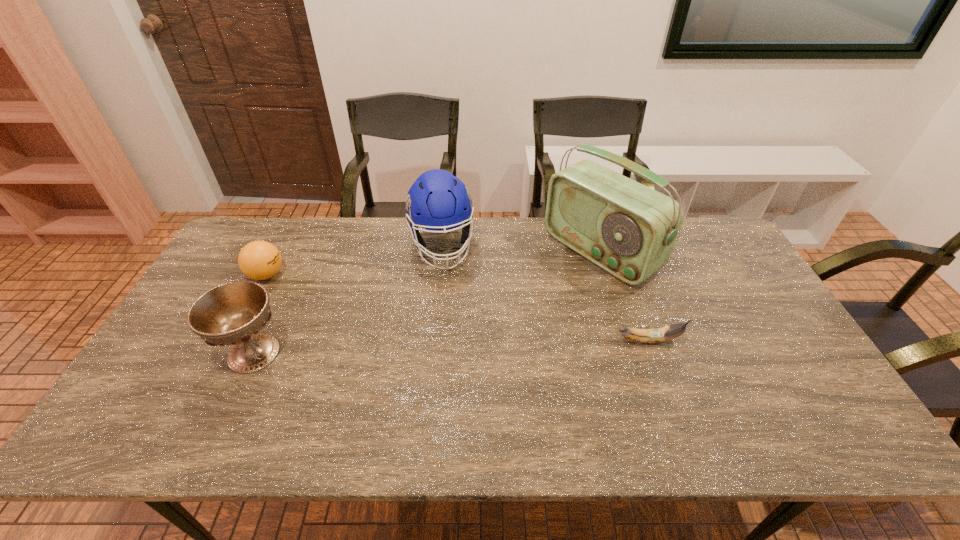
Identify the location of vacant space situated on the front panel of the tallest object. (493, 326).

At what (x,y) coordinates should I click in order to perform the action: click on free space located on the side with brand of the ping-pong ball. Please return your answer as a coordinate pair (x, y). The height and width of the screenshot is (540, 960). Looking at the image, I should click on (304, 295).

Locate an element on the screen. The image size is (960, 540). free space located on the side with brand of the ping-pong ball is located at coordinates (375, 333).

At what (x,y) coordinates should I click in order to perform the action: click on vacant space located 0.120m on the side with brand of the ping-pong ball. Please return your answer as a coordinate pair (x, y). Image resolution: width=960 pixels, height=540 pixels. Looking at the image, I should click on (307, 296).

Identify the location of free space located on the front-facing side of the football helmet. This screenshot has height=540, width=960. (462, 359).

Find the location of `vacant area situated on the front-facing side of the football helmet`. vacant area situated on the front-facing side of the football helmet is located at coordinates (463, 366).

Find the location of `vacant space situated on the front-facing side of the football helmet`. vacant space situated on the front-facing side of the football helmet is located at coordinates (462, 359).

Identify the location of radio receiver that is at the far edge. The width and height of the screenshot is (960, 540). (628, 229).

Identify the location of football helmet that is at the far edge. This screenshot has height=540, width=960. (437, 200).

In order to click on object that is at the near edge in this screenshot , I will do `click(234, 313)`.